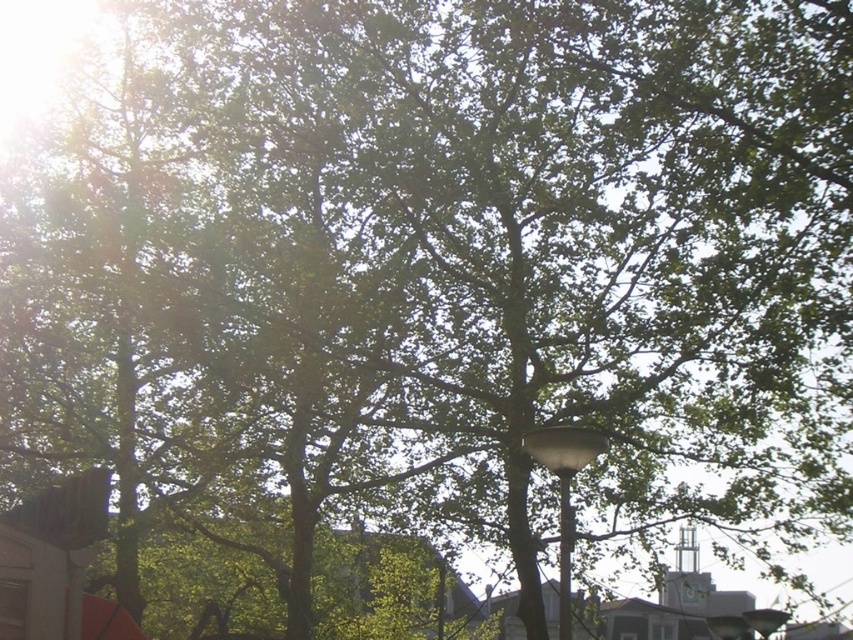
Question: Does green leafy tree at center appear over white glossy lamp post at center?

Choices:
 (A) no
 (B) yes

Answer: (A)

Question: Does green leafy tree at center come in front of white glossy lamp post at center?

Choices:
 (A) yes
 (B) no

Answer: (B)

Question: Among these points, which one is farthest from the camera?

Choices:
 (A) (251, 580)
 (B) (564, 429)

Answer: (A)

Question: Can you confirm if green leafy tree at center is thinner than white glossy lamp post at center?

Choices:
 (A) yes
 (B) no

Answer: (B)

Question: Which of the following is the closest to the observer?

Choices:
 (A) white glossy lamp post at center
 (B) green leafy tree at center

Answer: (A)